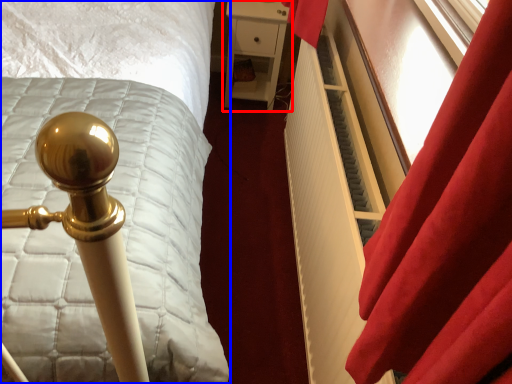
Question: Which of the following is the farthest to the observer, furniture (highlighted by a red box) or bed (highlighted by a blue box)?

Choices:
 (A) furniture
 (B) bed

Answer: (A)